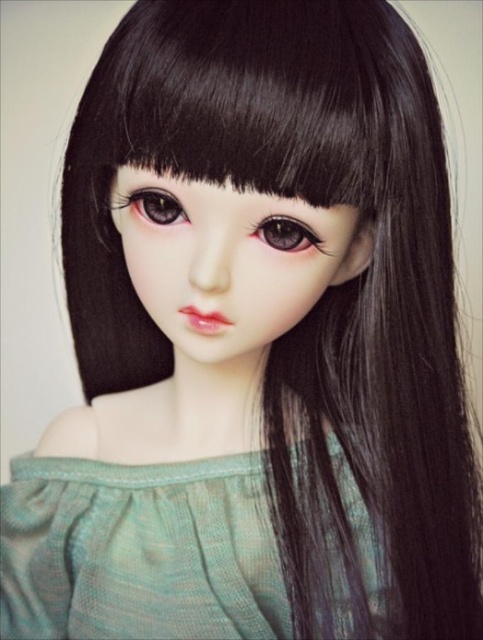
You are an artist sketching the doll and want to ensure the positioning of the black silky hair at upper center and the satin brown eye at center is accurate. Based on the image, which object is positioned to the left?

The black silky hair at upper center is positioned to the left of the satin brown eye at center according to the description.

You are an artist trying to sketch the doll from the image. You need to decide the order to draw the elements. Should you draw the green knitted dress at center before or after the brown glossy eye at center?

The green knitted dress at center is positioned on the right side of brown glossy eye at center, so you should draw the brown glossy eye at center first and then the green knitted dress at center to ensure proper placement.